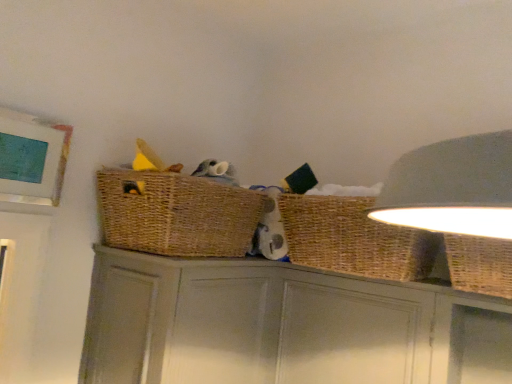
Question: Should I look upward or downward to see matte gray cabinet at center?

Choices:
 (A) up
 (B) down

Answer: (B)

Question: Considering the relative sizes of woven brown basket at upper center and matte gray cabinet at center in the image provided, is woven brown basket at upper center wider than matte gray cabinet at center?

Choices:
 (A) yes
 (B) no

Answer: (B)

Question: Is woven brown basket at upper center thinner than matte gray cabinet at center?

Choices:
 (A) yes
 (B) no

Answer: (A)

Question: Can you confirm if woven brown basket at upper center is positioned to the left of matte gray cabinet at center?

Choices:
 (A) no
 (B) yes

Answer: (B)

Question: From a real-world perspective, is woven brown basket at upper center on matte gray cabinet at center?

Choices:
 (A) yes
 (B) no

Answer: (A)

Question: From a real-world perspective, is woven brown basket at upper center beneath matte gray cabinet at center?

Choices:
 (A) yes
 (B) no

Answer: (B)

Question: Would you say woven brown basket at upper center contains matte gray cabinet at center?

Choices:
 (A) no
 (B) yes

Answer: (A)

Question: Does woven brown basket at upper center come in front of woven wicker basket at right, which is the second basket in right-to-left order?

Choices:
 (A) no
 (B) yes

Answer: (B)

Question: Can you confirm if woven brown basket at upper center is bigger than woven wicker basket at right, the first basket from the left?

Choices:
 (A) no
 (B) yes

Answer: (B)

Question: Is woven brown basket at upper center smaller than woven wicker basket at right, the first basket from the left?

Choices:
 (A) no
 (B) yes

Answer: (A)

Question: Can you confirm if woven brown basket at upper center is wider than woven wicker basket at right, which is the second basket in right-to-left order?

Choices:
 (A) yes
 (B) no

Answer: (A)

Question: Considering the relative positions of woven brown basket at upper center and woven wicker basket at right, which is the second basket in right-to-left order, in the image provided, is woven brown basket at upper center to the left of woven wicker basket at right, which is the second basket in right-to-left order, from the viewer's perspective?

Choices:
 (A) yes
 (B) no

Answer: (A)

Question: Is woven brown basket at upper center surrounding woven wicker basket at right, the first basket from the left?

Choices:
 (A) yes
 (B) no

Answer: (B)

Question: From the image's perspective, is woven wicker basket at upper right, which is counted as the first basket, starting from the right, above woven wicker basket at right, the first basket from the left?

Choices:
 (A) yes
 (B) no

Answer: (B)